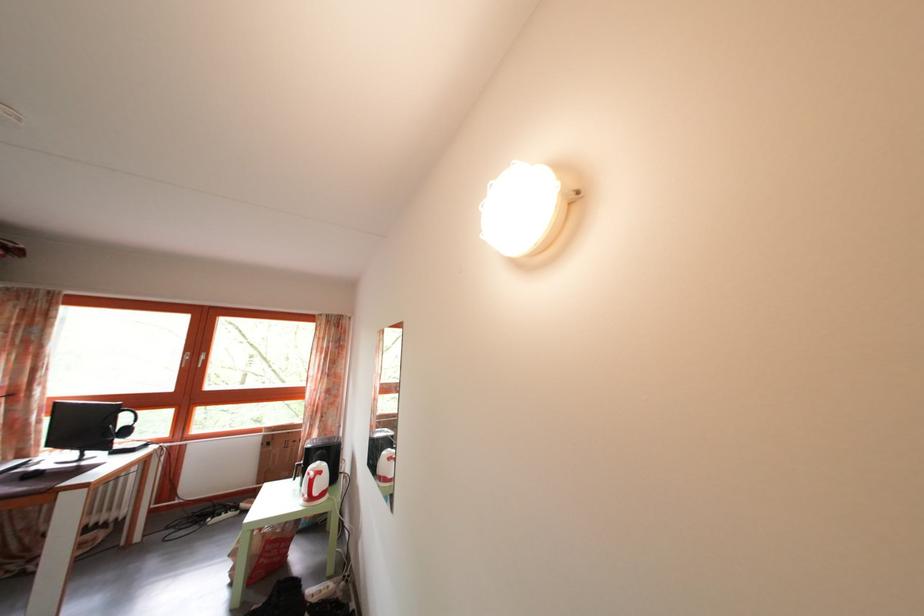
This screenshot has width=924, height=616. Identify the location of computer mouse. (30, 474).